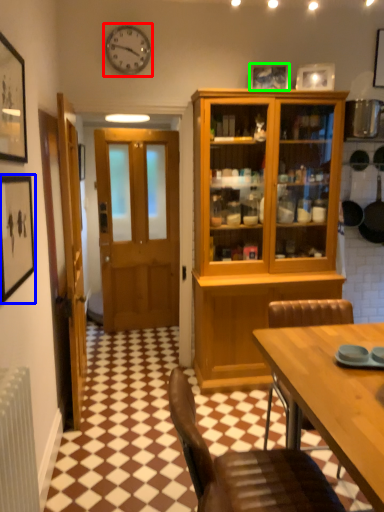
Question: Which object is the farthest from clock (highlighted by a red box)? Choose among these: picture frame (highlighted by a blue box) or picture frame (highlighted by a green box).

Choices:
 (A) picture frame
 (B) picture frame

Answer: (A)